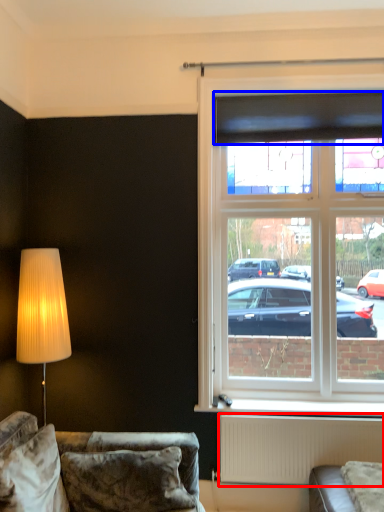
Question: Which point is further to the camera, radiator (highlighted by a red box) or curtain (highlighted by a blue box)?

Choices:
 (A) radiator
 (B) curtain

Answer: (B)